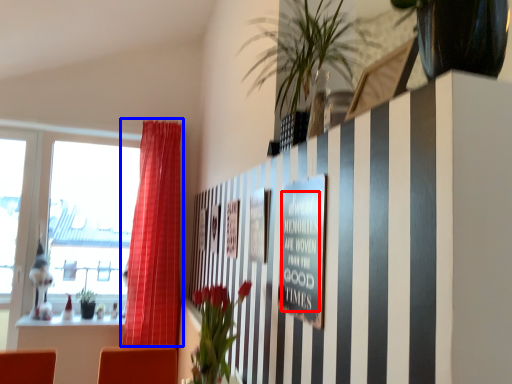
Question: Among these objects, which one is farthest to the camera, writing (highlighted by a red box) or curtain (highlighted by a blue box)?

Choices:
 (A) writing
 (B) curtain

Answer: (B)